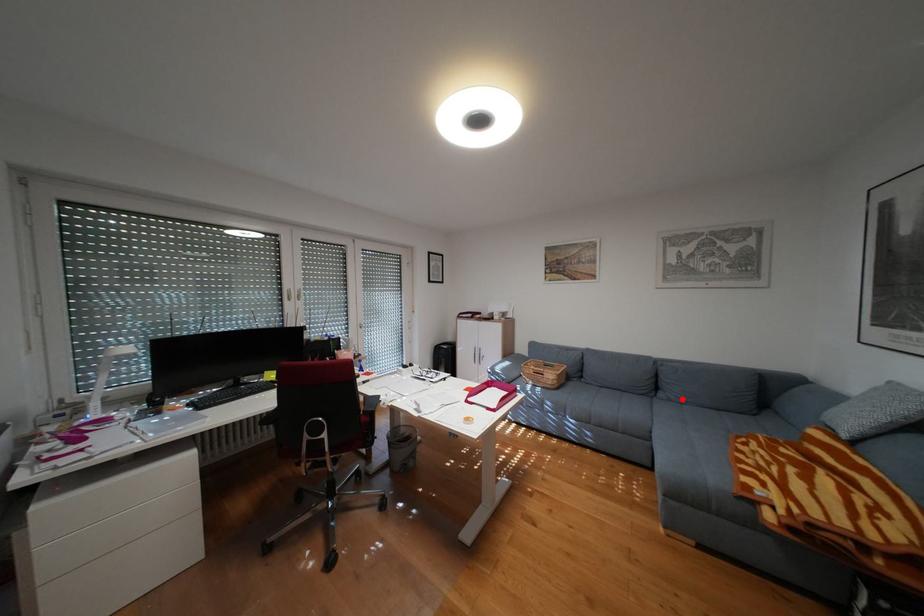
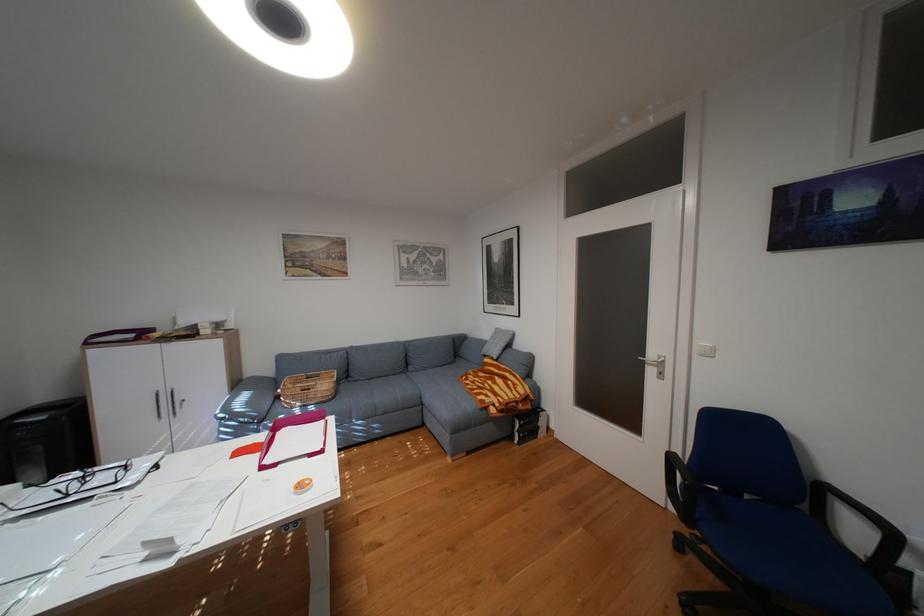
Find the pixel in the second image that matches the highlighted location in the first image.

(430, 370)